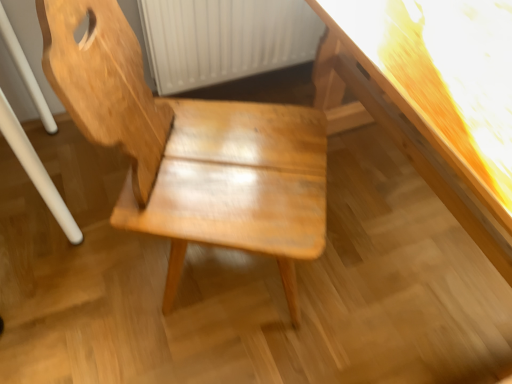
Locate an element on the screen. This screenshot has height=384, width=512. vacant space in front of wooden chair at center is located at coordinates (201, 353).